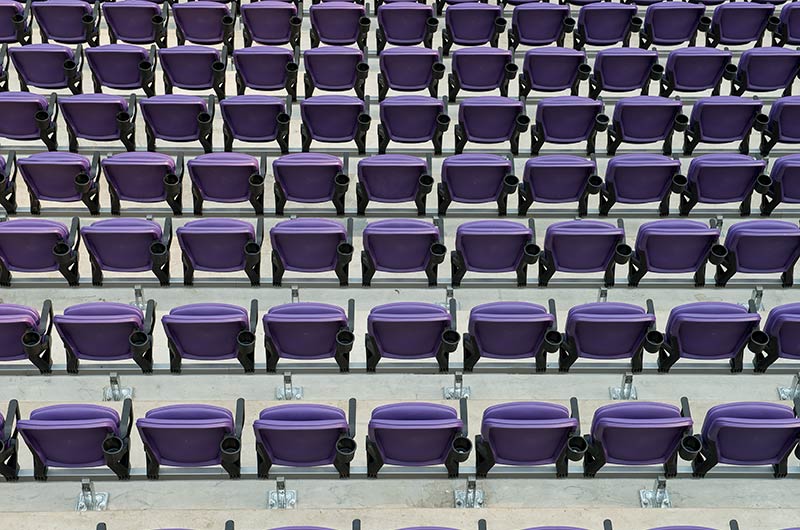
Find the location of `middle row of seats`. middle row of seats is located at coordinates pos(58,186), pos(129,178), pos(218,180), pos(302,183), pos(382,183), pos(468,188), pos(561,189), pos(629,191), pos(732,187), pos(786,189).